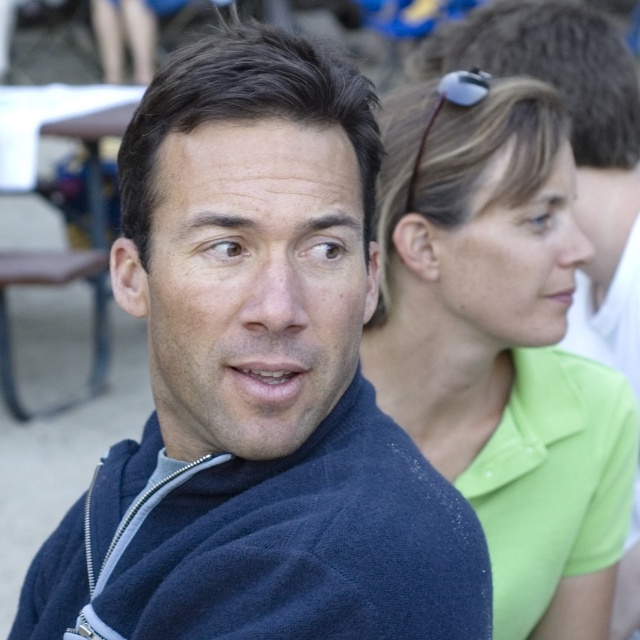
Between matte blue sweater at center and green matte shirt at upper right, which one appears on the left side from the viewer's perspective?

Positioned to the left is matte blue sweater at center.

Which is behind, point (353, 269) or point (520, 80)?

The point (520, 80) is more distant.

Find the location of a particular element. Image resolution: width=640 pixels, height=640 pixels. matte blue sweater at center is located at coordinates (257, 381).

Can you confirm if dark blue fleece sweatshirt at center is taller than matte blue face at center?

No.

Is dark blue fleece sweatshirt at center smaller than matte blue face at center?

No, dark blue fleece sweatshirt at center is not smaller than matte blue face at center.

Is point (403, 477) in front of point (332, 376)?

No.

Image resolution: width=640 pixels, height=640 pixels. In order to click on dark blue fleece sweatshirt at center in this screenshot , I will do `click(282, 548)`.

Is point (442, 214) in front of point (556, 179)?

Yes.

Who is more distant from viewer, (x=493, y=384) or (x=548, y=284)?

Point (x=493, y=384)

Is point (516, 554) farther from viewer compared to point (515, 323)?

Yes, it is.

The image size is (640, 640). I want to click on green matte shirt at upper right, so click(500, 346).